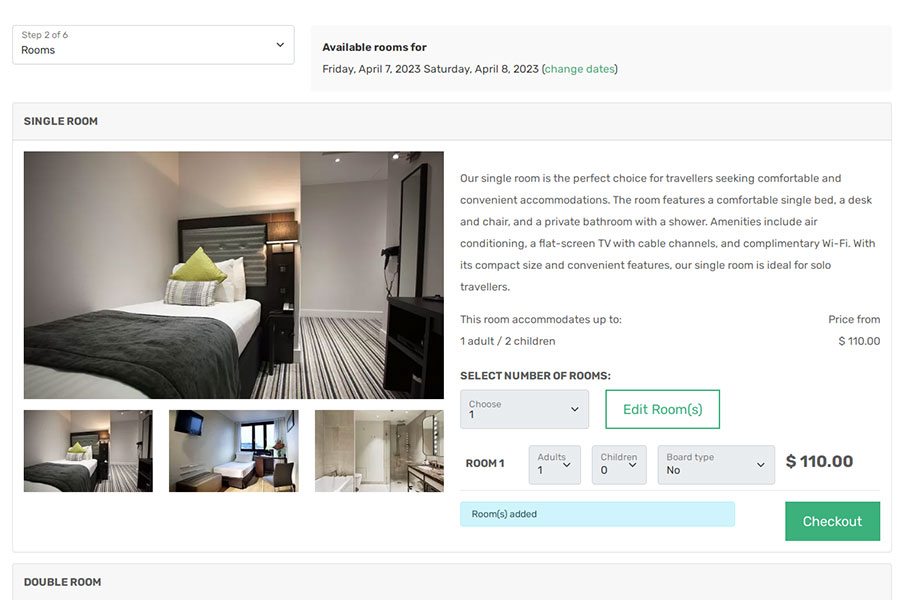
Locate an element on the screen. This screenshot has height=600, width=900. picture of room bathroom is located at coordinates (364, 456).